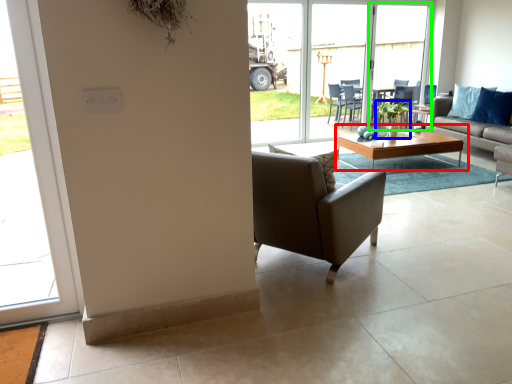
Question: Which object is the farthest from coffee table (highlighted by a red box)? Choose among these: houseplant (highlighted by a blue box) or screen door (highlighted by a green box).

Choices:
 (A) houseplant
 (B) screen door

Answer: (B)